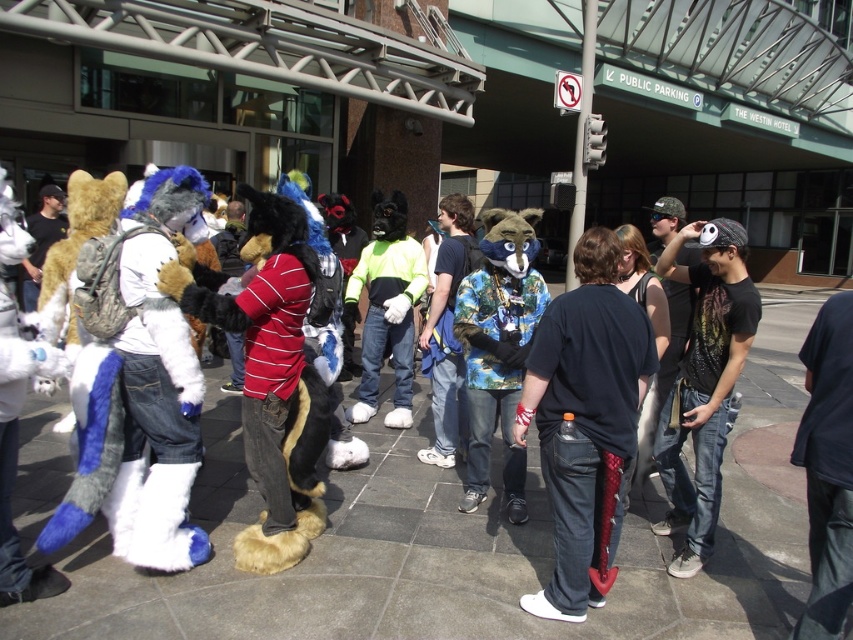
Question: Can you confirm if dark blue hoodie at center is wider than neon green and black costume at center?

Choices:
 (A) no
 (B) yes

Answer: (A)

Question: Does black matte t-shirt at center have a smaller size compared to fluffy blue and white costume at center?

Choices:
 (A) yes
 (B) no

Answer: (B)

Question: Which of these objects is positioned closest to the neon green and black costume at center?

Choices:
 (A) fluffy blue and white costume at center
 (B) fluffy fur coat at center

Answer: (B)

Question: Which point appears closest to the camera in this image?

Choices:
 (A) (448, 296)
 (B) (550, 449)

Answer: (B)

Question: Based on their relative distances, which object is farther from the fluffy blue and white costume at center?

Choices:
 (A) neon green and black costume at center
 (B) fluffy fur coat at center

Answer: (A)

Question: Can you confirm if dark blue hoodie at center is wider than fluffy fur coat at center?

Choices:
 (A) no
 (B) yes

Answer: (B)